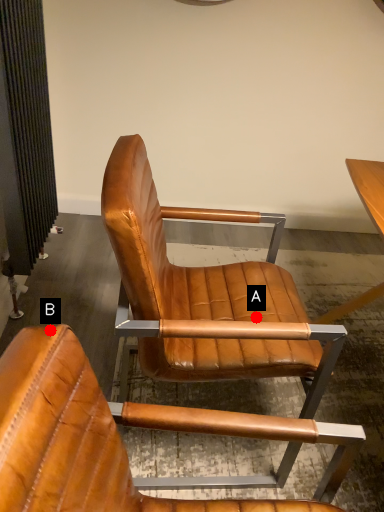
Question: Two points are circled on the image, labeled by A and B beside each circle. Which of the following is the closest to the observer?

Choices:
 (A) A is closer
 (B) B is closer

Answer: (B)